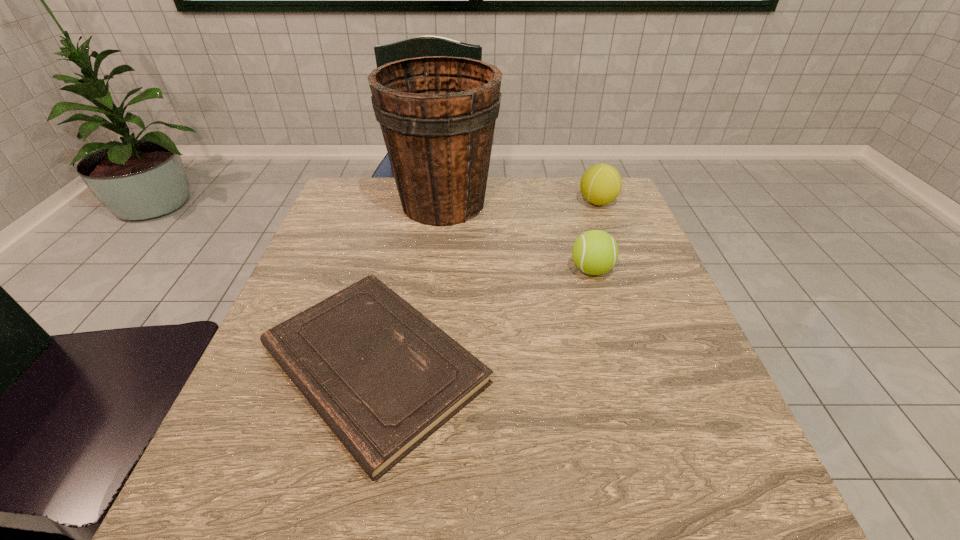
Locate an element on the screen. empty location between the nearest object and the tallest object is located at coordinates (409, 284).

Find the location of a particular element. Image resolution: width=960 pixels, height=540 pixels. vacant region between the farther tennis ball and the shortest object is located at coordinates (486, 284).

Where is `object identified as the third closest to the bucket`? object identified as the third closest to the bucket is located at coordinates (600, 184).

Select which object appears as the third closest to the nearer tennis ball. Please provide its 2D coordinates. Your answer should be formatted as a tuple, i.e. [(x, y)], where the tuple contains the x and y coordinates of a point satisfying the conditions above.

[(600, 184)]

Where is `free location that satisfies the following two spatial constraints: 1. on the back side of the bucket; 2. on the left side of the shortest object`? Image resolution: width=960 pixels, height=540 pixels. free location that satisfies the following two spatial constraints: 1. on the back side of the bucket; 2. on the left side of the shortest object is located at coordinates (411, 203).